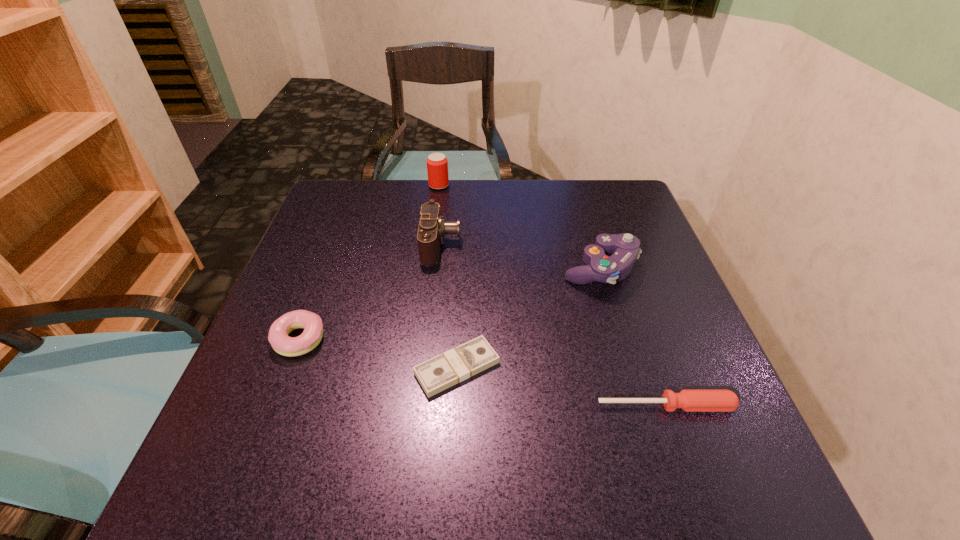
Locate an element on the screen. The image size is (960, 540). beer can is located at coordinates (437, 164).

You are a GUI agent. You are given a task and a screenshot of the screen. Output one action in this format:
    pyautogui.click(x=<x>, y=<y>)
    Task: Click on the camera
    
    Given the screenshot: What is the action you would take?
    pyautogui.click(x=432, y=228)

Where is `control`? control is located at coordinates (624, 247).

The width and height of the screenshot is (960, 540). What are the coordinates of `doughnut` in the screenshot? It's located at (278, 337).

Where is `the fourth tallest object`? the fourth tallest object is located at coordinates (278, 337).

Where is `screwdriver`? The image size is (960, 540). screwdriver is located at coordinates (688, 400).

What are the coordinates of `dollar` in the screenshot? It's located at (464, 361).

Identify the location of free location located 0.160m on the front of the farthest object. (434, 224).

Locate an element on the screen. Image resolution: width=960 pixels, height=540 pixels. free space located on the front-facing side of the camera is located at coordinates (583, 244).

You are a GUI agent. You are given a task and a screenshot of the screen. Output one action in this format:
    pyautogui.click(x=<x>, y=<y>)
    Task: Click on the vacant space located on the left of the control
    This screenshot has height=540, width=960.
    Given the screenshot: What is the action you would take?
    pyautogui.click(x=496, y=268)